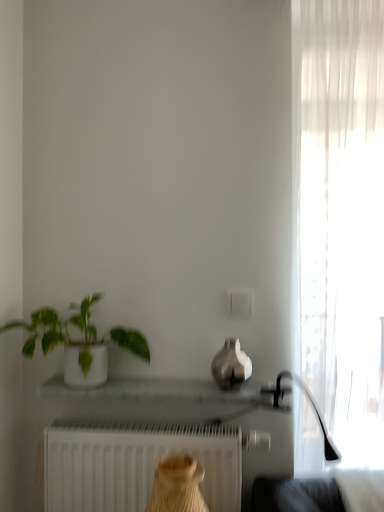
Question: Can you confirm if satin silver vase at center is thinner than white matte radiator at lower center?

Choices:
 (A) yes
 (B) no

Answer: (B)

Question: From a real-world perspective, does satin silver vase at center stand above white matte radiator at lower center?

Choices:
 (A) no
 (B) yes

Answer: (B)

Question: Is satin silver vase at center at the right side of white matte radiator at lower center?

Choices:
 (A) no
 (B) yes

Answer: (B)

Question: From a real-world perspective, is satin silver vase at center located beneath white matte radiator at lower center?

Choices:
 (A) no
 (B) yes

Answer: (A)

Question: From the image's perspective, is satin silver vase at center located beneath white matte radiator at lower center?

Choices:
 (A) yes
 (B) no

Answer: (B)

Question: In terms of size, does white glossy tray at center appear bigger or smaller than white glossy pot at left?

Choices:
 (A) big
 (B) small

Answer: (B)

Question: Is point (193, 400) closer or farther from the camera than point (127, 329)?

Choices:
 (A) closer
 (B) farther

Answer: (A)

Question: Considering the positions of white glossy tray at center and white glossy pot at left in the image, is white glossy tray at center taller or shorter than white glossy pot at left?

Choices:
 (A) short
 (B) tall

Answer: (A)

Question: From a real-world perspective, relative to white glossy pot at left, is white glossy tray at center vertically above or below?

Choices:
 (A) above
 (B) below

Answer: (B)

Question: Considering the positions of white glossy tray at center and white matte radiator at lower center in the image, is white glossy tray at center taller or shorter than white matte radiator at lower center?

Choices:
 (A) short
 (B) tall

Answer: (A)

Question: From a real-world perspective, is white glossy tray at center physically located above or below white matte radiator at lower center?

Choices:
 (A) below
 (B) above

Answer: (B)

Question: In terms of width, does white glossy tray at center look wider or thinner when compared to white matte radiator at lower center?

Choices:
 (A) wide
 (B) thin

Answer: (A)

Question: From the image's perspective, relative to white matte radiator at lower center, is white glossy tray at center above or below?

Choices:
 (A) below
 (B) above

Answer: (B)

Question: Considering the positions of white sheer curtain at right and white glossy pot at left in the image, is white sheer curtain at right wider or thinner than white glossy pot at left?

Choices:
 (A) wide
 (B) thin

Answer: (A)

Question: In the image, is white sheer curtain at right positioned in front of or behind white glossy pot at left?

Choices:
 (A) behind
 (B) front

Answer: (A)